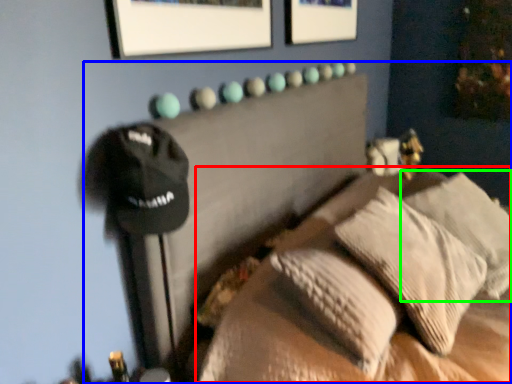
Question: Considering the real-world distances, which object is farthest from bed (highlighted by a red box)? furniture (highlighted by a blue box) or pillow (highlighted by a green box)?

Choices:
 (A) furniture
 (B) pillow

Answer: (B)